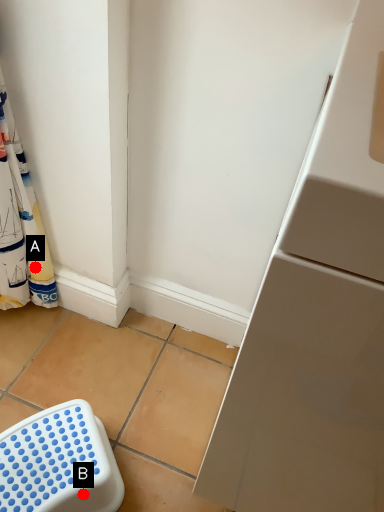
Question: Two points are circled on the image, labeled by A and B beside each circle. Which point is closer to the camera taking this photo?

Choices:
 (A) A is closer
 (B) B is closer

Answer: (B)